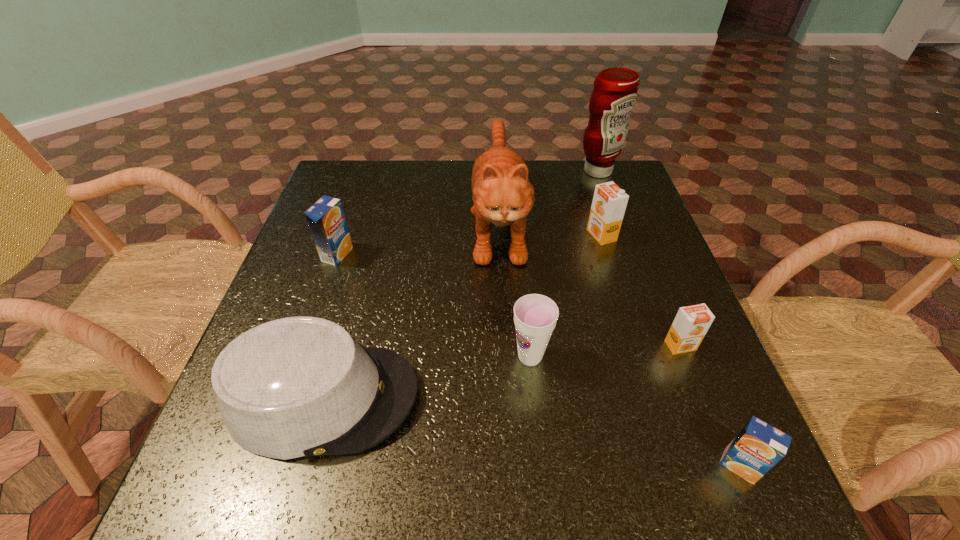
Identify the location of condiment at the far edge. The image size is (960, 540). (614, 95).

Locate an element on the screen. cat that is at the far edge is located at coordinates (502, 194).

You are a GUI agent. You are given a task and a screenshot of the screen. Output one action in this format:
    pyautogui.click(x=<x>, y=<y>)
    Task: Click on the hat at the near edge
    The height and width of the screenshot is (540, 960).
    Given the screenshot: What is the action you would take?
    pyautogui.click(x=296, y=387)

Locate an element on the screen. This screenshot has height=540, width=960. orange_juice located at the near edge is located at coordinates (759, 446).

What are the coordinates of `orange_juice that is at the left edge` in the screenshot? It's located at [x=326, y=219].

Where is `hat at the left edge`? hat at the left edge is located at coordinates (296, 387).

You are a GUI agent. You are given a task and a screenshot of the screen. Output one action in this format:
    pyautogui.click(x=<x>, y=<y>)
    Task: Click on the condiment that is at the right edge
    The width and height of the screenshot is (960, 540).
    Given the screenshot: What is the action you would take?
    pyautogui.click(x=614, y=95)

In order to click on object located at the near left corner in this screenshot , I will do pyautogui.click(x=296, y=387).

The width and height of the screenshot is (960, 540). In order to click on object located at the far right corner in this screenshot , I will do `click(614, 95)`.

At what (x,y) coordinates should I click in order to perform the action: click on object present at the near right corner. Please return your answer as a coordinate pair (x, y). Looking at the image, I should click on (759, 446).